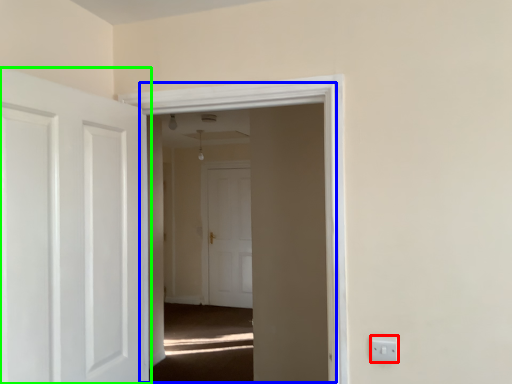
Question: Which is farther away from electric outlet (highlighted by a red box)? window (highlighted by a blue box) or door (highlighted by a green box)?

Choices:
 (A) window
 (B) door

Answer: (B)